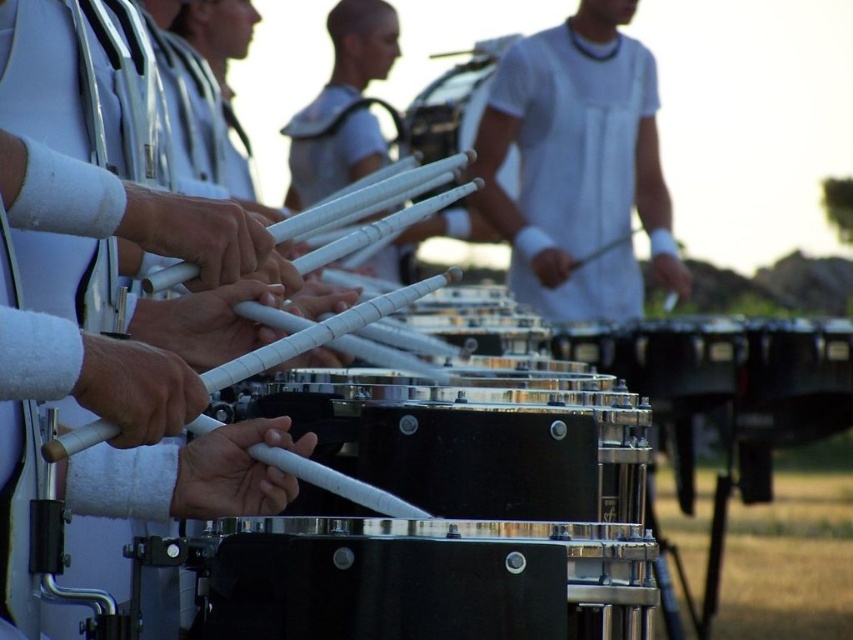
Is white matte shirt at center thinner than black polished drum at center?

No, white matte shirt at center is not thinner than black polished drum at center.

Between white matte shirt at center and black polished drum at center, which one is positioned lower?

black polished drum at center is lower down.

Locate an element on the screen. white matte shirt at center is located at coordinates (578, 166).

Can you confirm if white matte shirt at center is positioned to the left of black metallic drum at center?

No, white matte shirt at center is not to the left of black metallic drum at center.

Describe the element at coordinates (578, 166) in the screenshot. This screenshot has height=640, width=853. I see `white matte shirt at center` at that location.

Which is behind, point (576, 268) or point (518, 486)?

Positioned behind is point (576, 268).

Find the location of a particular element. white matte shirt at center is located at coordinates (578, 166).

The image size is (853, 640). Find the location of `black metallic drum at center`. black metallic drum at center is located at coordinates (482, 460).

Can you confirm if black metallic drum at center is bigger than black polished drum at center?

Actually, black metallic drum at center might be smaller than black polished drum at center.

Locate an element on the screen. The width and height of the screenshot is (853, 640). black metallic drum at center is located at coordinates (482, 460).